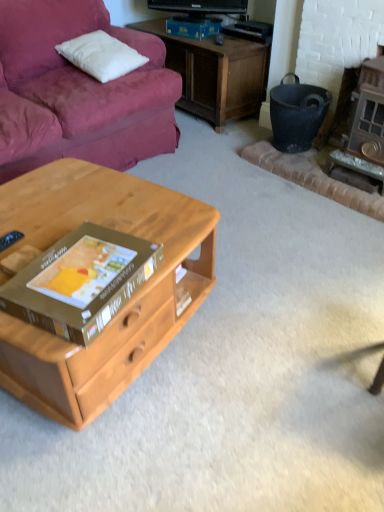
Question: Considering the relative sizes of wooden fireplace at right and black matte trash bin/can at right in the image provided, is wooden fireplace at right wider than black matte trash bin/can at right?

Choices:
 (A) yes
 (B) no

Answer: (A)

Question: From the image's perspective, would you say wooden fireplace at right is shown under black matte trash bin/can at right?

Choices:
 (A) yes
 (B) no

Answer: (A)

Question: Can you see wooden fireplace at right touching black matte trash bin/can at right?

Choices:
 (A) no
 (B) yes

Answer: (A)

Question: Does wooden fireplace at right have a greater height compared to black matte trash bin/can at right?

Choices:
 (A) yes
 (B) no

Answer: (A)

Question: Is wooden fireplace at right thinner than black matte trash bin/can at right?

Choices:
 (A) no
 (B) yes

Answer: (A)

Question: Is the position of wooden fireplace at right more distant than that of black matte trash bin/can at right?

Choices:
 (A) no
 (B) yes

Answer: (A)

Question: Can you confirm if white soft pillow at upper left is positioned to the right of light wood desk at center?

Choices:
 (A) yes
 (B) no

Answer: (B)

Question: Is white soft pillow at upper left smaller than light wood desk at center?

Choices:
 (A) no
 (B) yes

Answer: (B)

Question: Is white soft pillow at upper left far away from light wood desk at center?

Choices:
 (A) no
 (B) yes

Answer: (B)

Question: Is white soft pillow at upper left positioned before light wood desk at center?

Choices:
 (A) no
 (B) yes

Answer: (A)

Question: Does white soft pillow at upper left turn towards light wood desk at center?

Choices:
 (A) no
 (B) yes

Answer: (A)

Question: Is light wood desk at center a part of white soft pillow at upper left?

Choices:
 (A) yes
 (B) no

Answer: (B)

Question: Is black matte trash bin/can at right closer to camera compared to wooden fireplace at right?

Choices:
 (A) no
 (B) yes

Answer: (A)